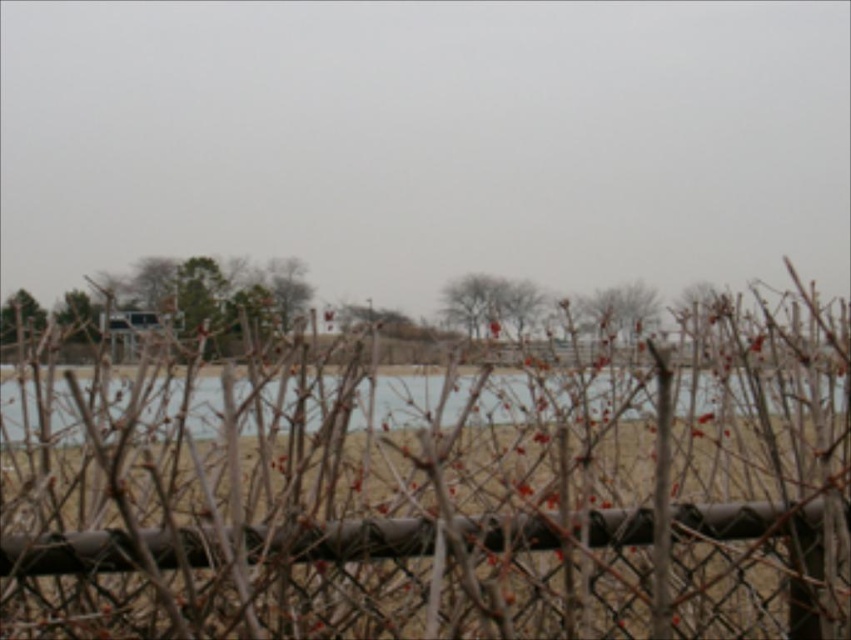
Which is in front, point (798, 602) or point (589, 326)?

Point (798, 602) is more forward.

Image resolution: width=851 pixels, height=640 pixels. What do you see at coordinates (343, 540) in the screenshot?
I see `metallic chain-link fence at center` at bounding box center [343, 540].

Who is more forward, [420,547] or [594,300]?

Positioned in front is point [420,547].

The image size is (851, 640). What are the coordinates of `metallic chain-link fence at center` in the screenshot? It's located at (343, 540).

Can you confirm if clear water at center is thinner than brown textured tree at left?

Yes.

Is point (77, 432) closer to camera compared to point (21, 305)?

Yes.

Measure the distance between point (734,404) and camera.

Point (734,404) is 2.29 meters from camera.

Image resolution: width=851 pixels, height=640 pixels. I want to click on clear water at center, so click(x=397, y=401).

Who is shorter, metallic chain-link fence at center or bare branches at center?

metallic chain-link fence at center is shorter.

The image size is (851, 640). I want to click on metallic chain-link fence at center, so click(x=343, y=540).

Describe the element at coordinates (343, 540) in the screenshot. I see `metallic chain-link fence at center` at that location.

Locate an element on the screen. The image size is (851, 640). metallic chain-link fence at center is located at coordinates (343, 540).